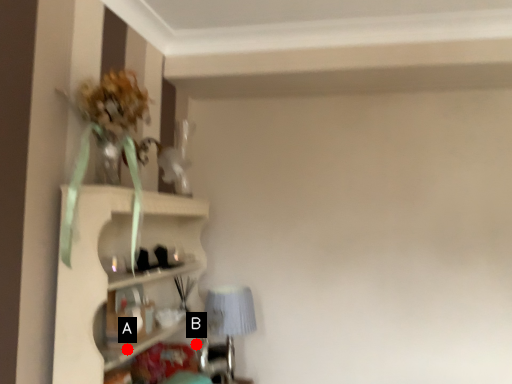
Question: Two points are circled on the image, labeled by A and B beside each circle. Which point is closer to the camera taking this photo?

Choices:
 (A) A is closer
 (B) B is closer

Answer: (A)